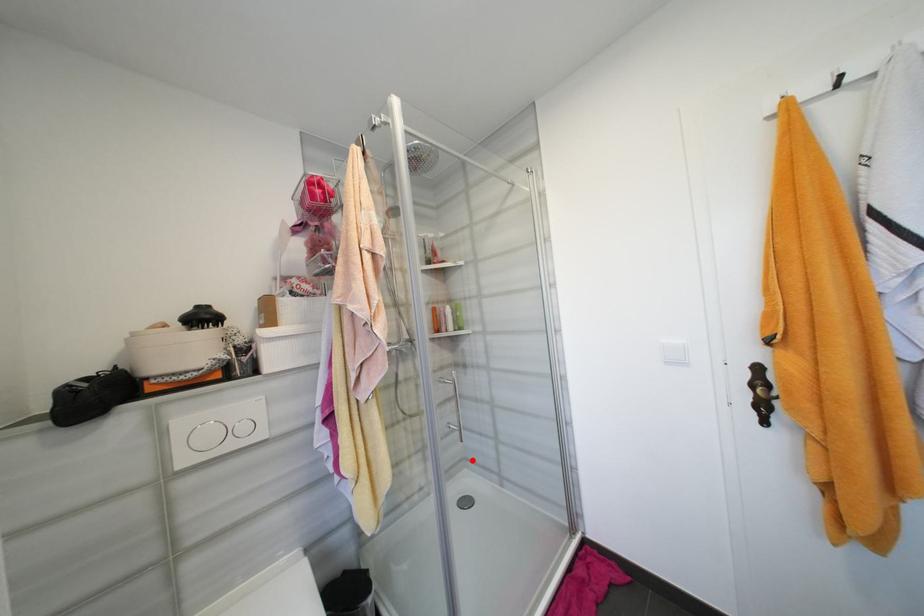
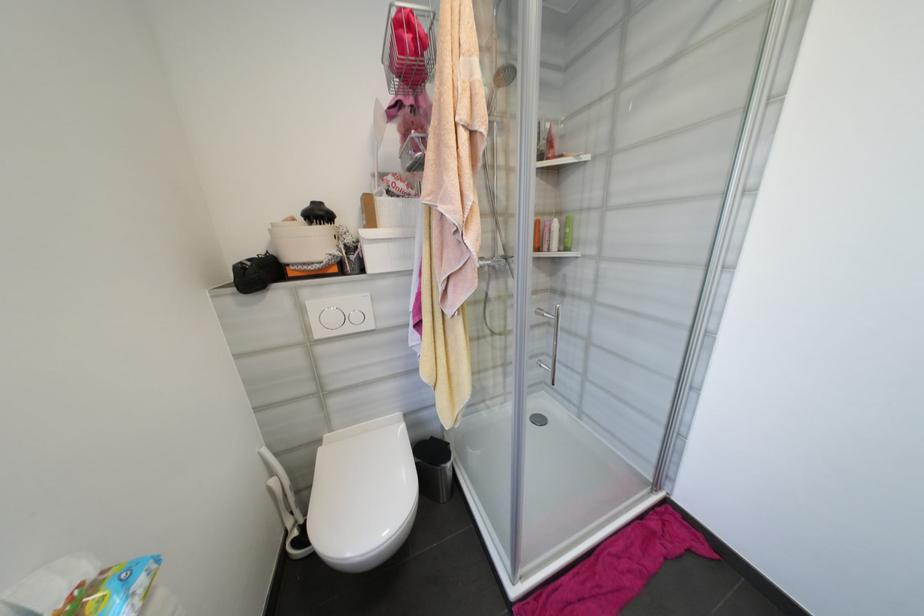
Question: I am providing you with two images of the same scene from different viewpoints. A red point is marked on the first image. At the location where the point appears in image 1, is it still visible in image 2?

Choices:
 (A) Yes
 (B) No

Answer: (A)